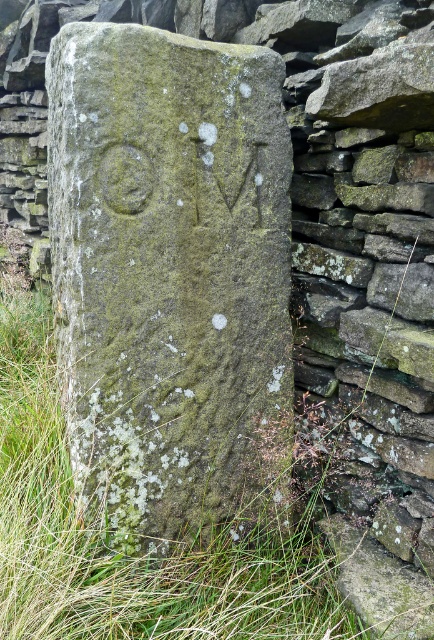
Question: Is green mossy stone at center thinner than green grass at lower left?

Choices:
 (A) no
 (B) yes

Answer: (B)

Question: Does green mossy stone at center lie in front of green grass at lower left?

Choices:
 (A) yes
 (B) no

Answer: (B)

Question: Which point is farther from the camera taking this photo?

Choices:
 (A) (256, 408)
 (B) (107, 525)

Answer: (A)

Question: Which point appears closest to the camera in this image?

Choices:
 (A) (197, 132)
 (B) (9, 406)

Answer: (A)

Question: Does green mossy stone at center appear on the left side of green grass at lower left?

Choices:
 (A) yes
 (B) no

Answer: (B)